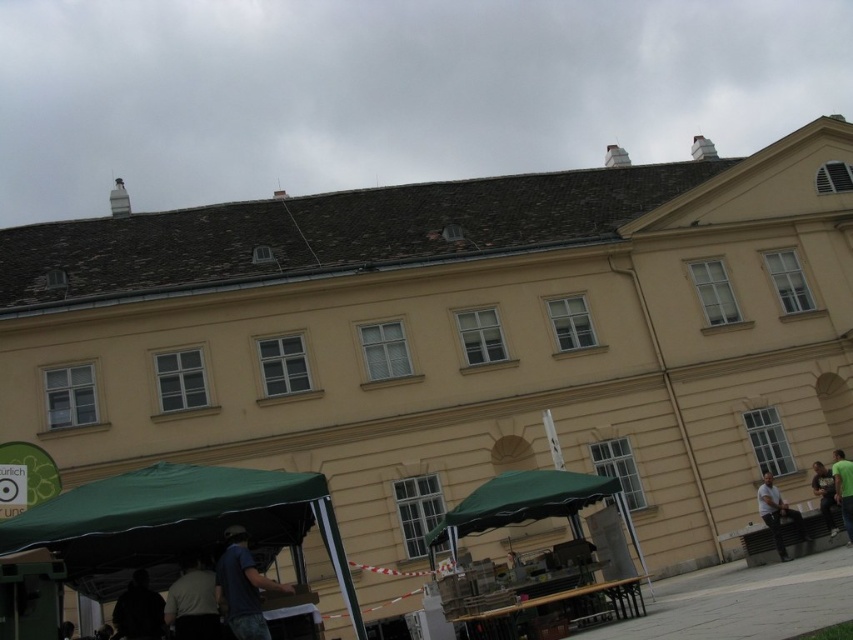
Question: Which object is closer to the camera taking this photo?

Choices:
 (A) white fabric shirt at right
 (B) green fabric canopy at lower left
 (C) dark gray shirt at lower center
 (D) dark blue shirt at center

Answer: (B)

Question: In this image, where is green fabric canopy at lower left located relative to green fabric canopy at center?

Choices:
 (A) right
 (B) left

Answer: (B)

Question: Can you confirm if green fabric canopy at lower left is positioned below dark gray shirt at lower center?

Choices:
 (A) no
 (B) yes

Answer: (A)

Question: Where is green fabric canopy at lower left located in relation to dark blue shirt at center in the image?

Choices:
 (A) below
 (B) above

Answer: (B)

Question: Which point is closer to the camera?

Choices:
 (A) (846, 524)
 (B) (96, 515)
 (C) (259, 625)
 (D) (767, 509)

Answer: (B)

Question: Based on their relative distances, which object is nearer to the dark gray shirt at lower center?

Choices:
 (A) green fabric canopy at center
 (B) white fabric shirt at right

Answer: (A)